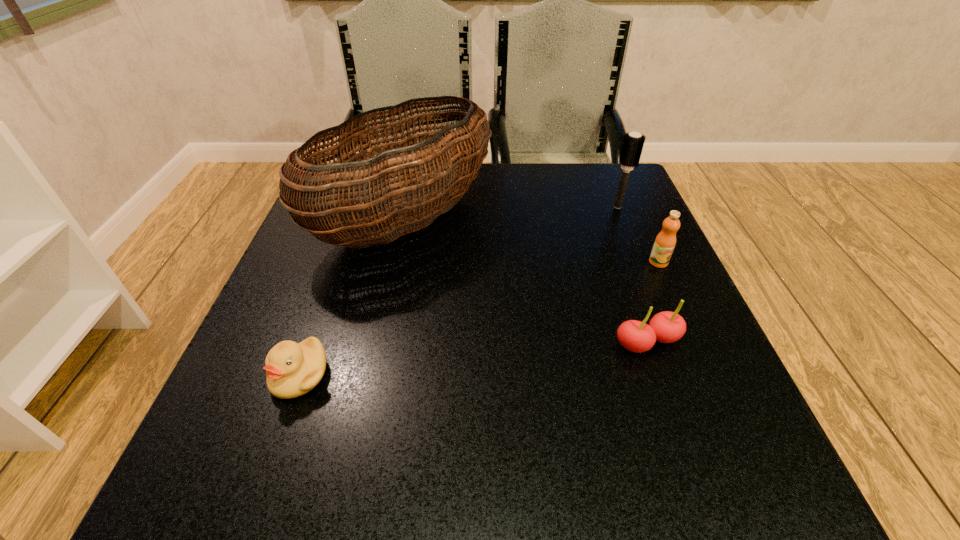
This screenshot has width=960, height=540. In order to click on basket in this screenshot , I will do `click(312, 207)`.

Locate an element on the screen. hairbrush is located at coordinates (633, 143).

Locate an element on the screen. The width and height of the screenshot is (960, 540). orange juice is located at coordinates (665, 242).

Locate an element on the screen. Image resolution: width=960 pixels, height=540 pixels. cherry is located at coordinates [x=666, y=327].

At what (x,y) coordinates should I click in order to perform the action: click on duckling. Please return your answer as a coordinate pair (x, y). The width and height of the screenshot is (960, 540). Looking at the image, I should click on (292, 369).

Find the location of a particular element. vacant position located 0.290m on the front of the tallest object is located at coordinates (362, 419).

What are the coordinates of `vacant area situated on the front of the hairbrush` in the screenshot? It's located at (636, 252).

Identify the location of free space located 0.220m on the front label of the orange juice. coord(703,360).

What are the coordinates of `free spot located 0.180m on the back of the cherry` in the screenshot? It's located at (618, 259).

Find the location of a particular element. vacant position located on the beak of the duckling is located at coordinates (269, 463).